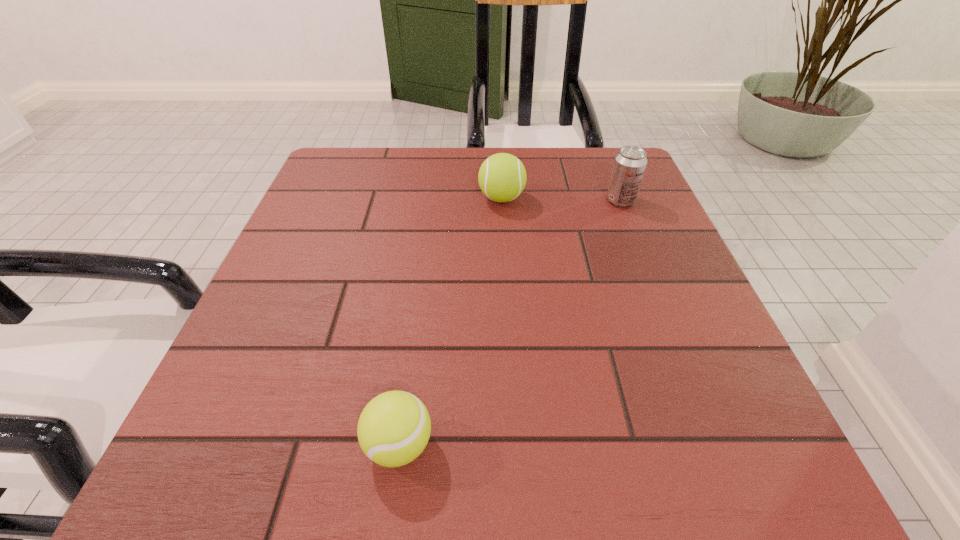
Where is `object that is at the near edge`? This screenshot has height=540, width=960. object that is at the near edge is located at coordinates (394, 427).

Locate an element on the screen. The width and height of the screenshot is (960, 540). object that is at the right edge is located at coordinates (630, 163).

I want to click on object that is at the far right corner, so click(630, 163).

At what (x,y) coordinates should I click in order to perform the action: click on vacant space at the far edge of the desktop. Please return your answer as a coordinate pair (x, y). Looking at the image, I should click on (433, 191).

Locate an element on the screen. free space at the near edge is located at coordinates (338, 436).

Locate an element on the screen. free location at the left edge of the desktop is located at coordinates (300, 242).

Identify the location of free spot at the right edge of the desktop. click(x=619, y=254).

In the image, there is a desktop. Find the location of `vacant region at the far left corner`. vacant region at the far left corner is located at coordinates (359, 159).

You are a GUI agent. You are given a task and a screenshot of the screen. Output one action in this format:
    pyautogui.click(x=<x>, y=<y>)
    Task: Click on the vacant space at the near left corner
    The image size is (960, 540).
    Given the screenshot: What is the action you would take?
    pyautogui.click(x=204, y=494)

In the image, there is a desktop. Find the location of `free space at the far right corner`. free space at the far right corner is located at coordinates (617, 151).